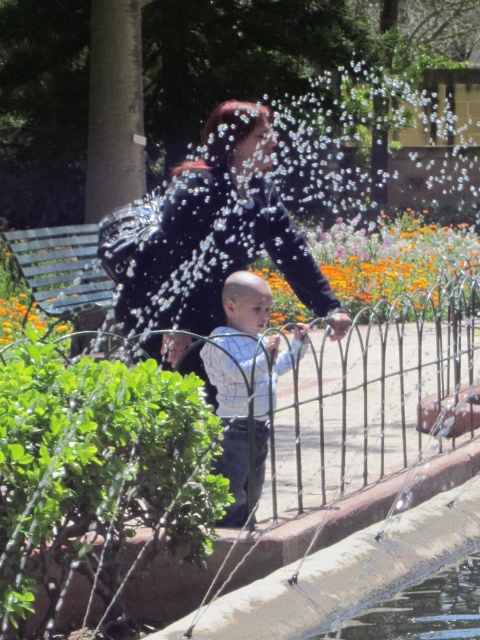
You are a photographer trying to capture a photo of both the matte black jacket at center and the light blue striped shirt at center in the same frame. Based on their sizes, which one should you focus on first to ensure both are in focus?

The matte black jacket at center is larger than the light blue striped shirt at center, so you should focus on the matte black jacket at center first to ensure both are in focus.

In the park scene, there is a child wearing a light blue striped shirt at center and a green metal bench at left. From the perspective of someone standing at the fountain, which object is positioned to the right?

The light blue striped shirt at center is positioned to the right of the green metal bench at left.

You are a photographer trying to capture a candid shot of the two people at the fountain. Since you want to focus on their interaction, you need to ensure both the matte black jacket at center and the light blue striped shirt at center are clearly visible in the frame. Based on their positioning, which one should you adjust your camera angle to prioritize capturing first?

The matte black jacket at center is positioned on the left side of light blue striped shirt at center. To ensure both are visible, prioritize capturing the matte black jacket at center first as it is closer to the edge of the potential frame, allowing you to adjust the angle to include the light blue striped shirt at center without losing the jacket from view.